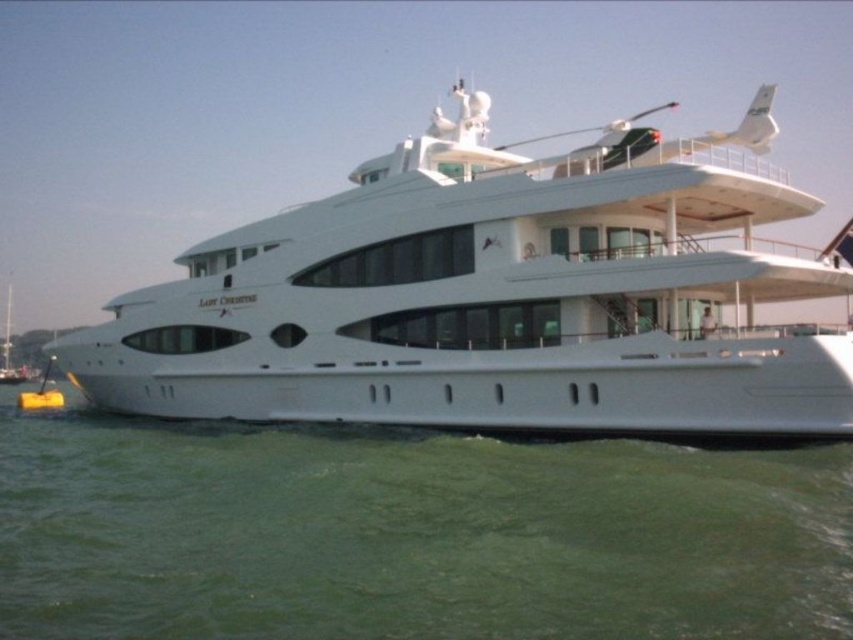
Question: Considering the relative positions of white glossy cruise ship at center and green water at lower center in the image provided, where is white glossy cruise ship at center located with respect to green water at lower center?

Choices:
 (A) left
 (B) right

Answer: (B)

Question: Which point is farther from the camera taking this photo?

Choices:
 (A) (107, 445)
 (B) (135, 388)

Answer: (B)

Question: Which object is closer to the camera taking this photo?

Choices:
 (A) white glossy cruise ship at center
 (B) green water at lower center

Answer: (B)

Question: Observing the image, what is the correct spatial positioning of white glossy cruise ship at center in reference to green water at lower center?

Choices:
 (A) above
 (B) below

Answer: (A)

Question: Can you confirm if white glossy cruise ship at center is wider than green water at lower center?

Choices:
 (A) no
 (B) yes

Answer: (B)

Question: Which of the following is the farthest from the observer?

Choices:
 (A) green water at lower center
 (B) white glossy cruise ship at center

Answer: (B)